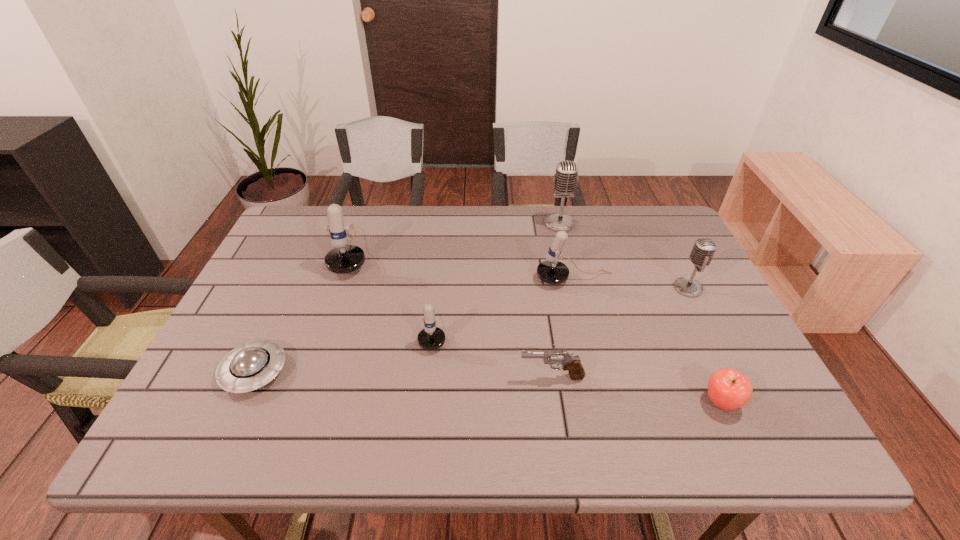
Where is `vacant point that satisfies the following two spatial constraints: 1. on the back side of the rightmost microphone; 2. on the right side of the saucer`? vacant point that satisfies the following two spatial constraints: 1. on the back side of the rightmost microphone; 2. on the right side of the saucer is located at coordinates (293, 288).